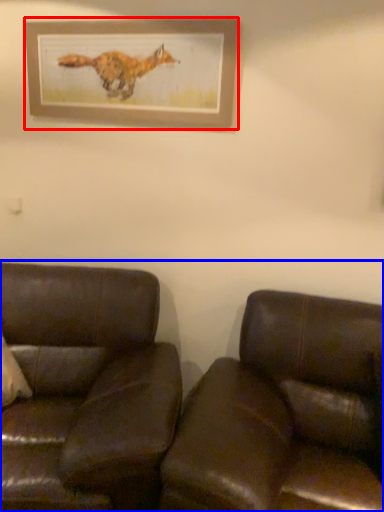
Question: Which point is further to the camera, picture frame (highlighted by a red box) or studio couch (highlighted by a blue box)?

Choices:
 (A) picture frame
 (B) studio couch

Answer: (A)